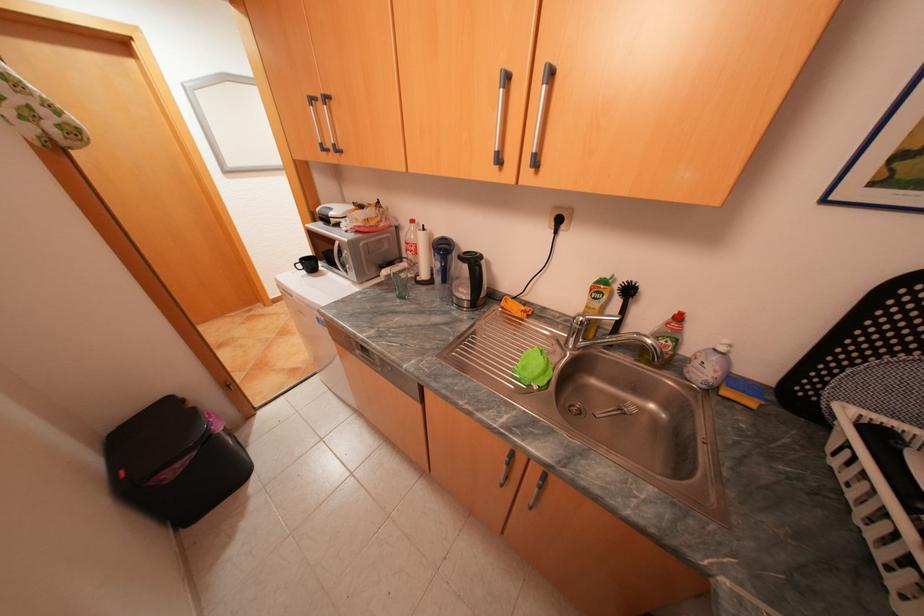
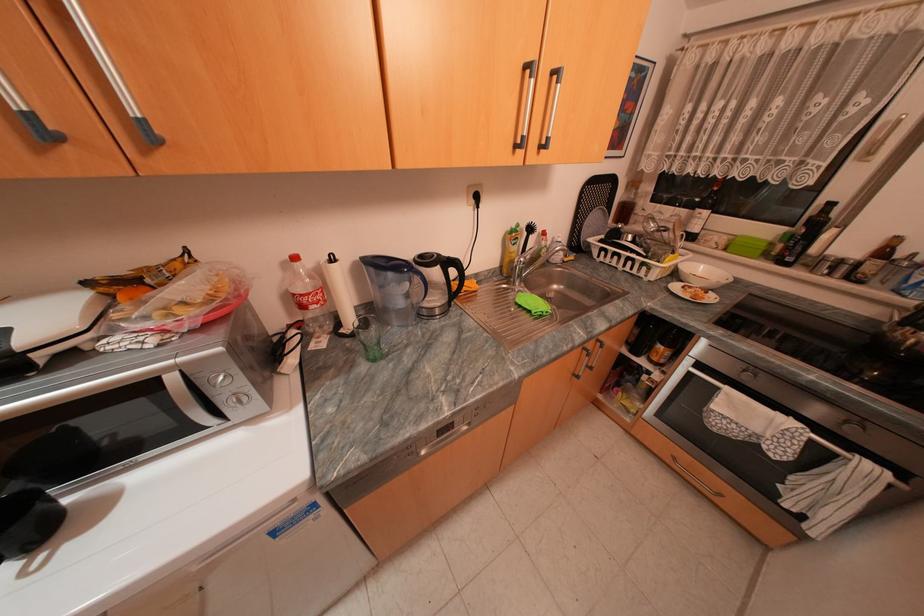
Locate, in the second image, the point that corresponds to pixel 556 333 in the first image.

(514, 285)